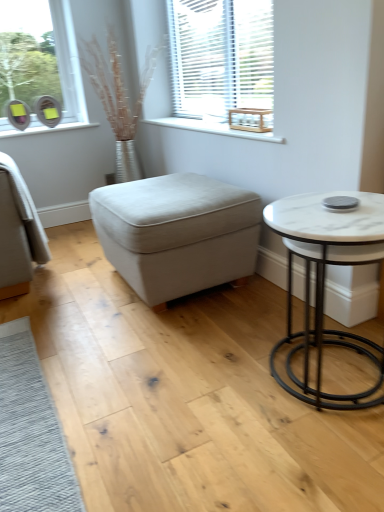
This screenshot has height=512, width=384. I want to click on free space in front of beige fabric ottoman at center, so click(163, 354).